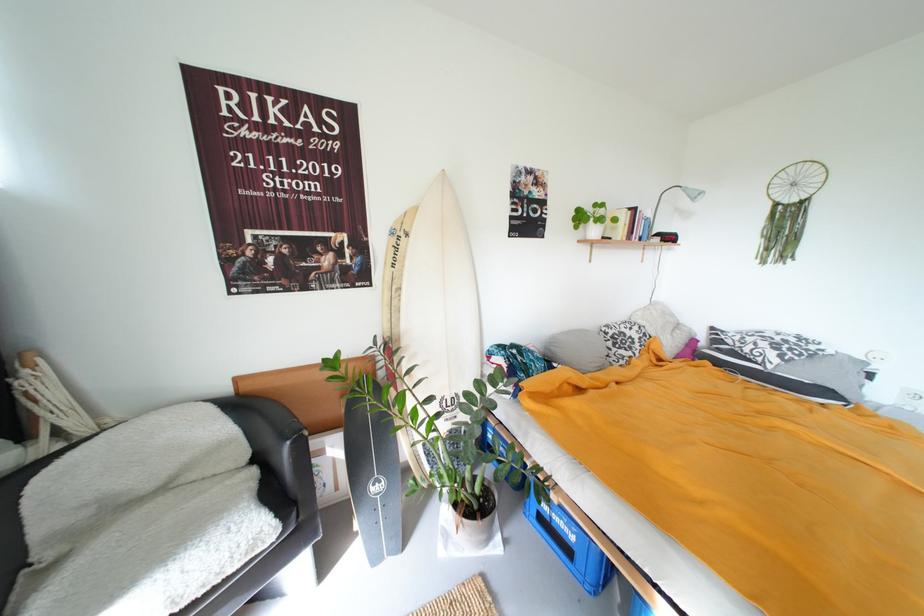
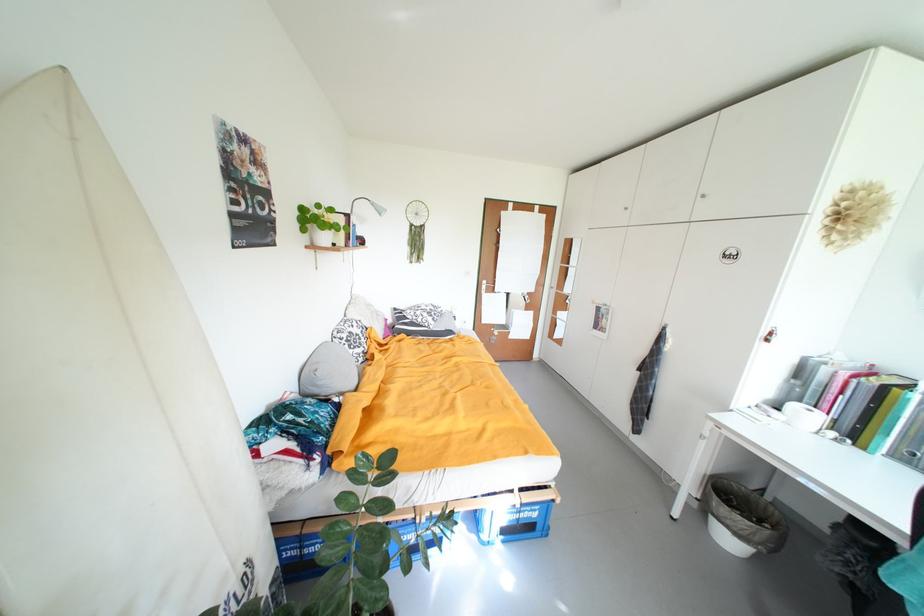
Find the pixel in the second image that matches (560,350) in the first image.

(326, 385)